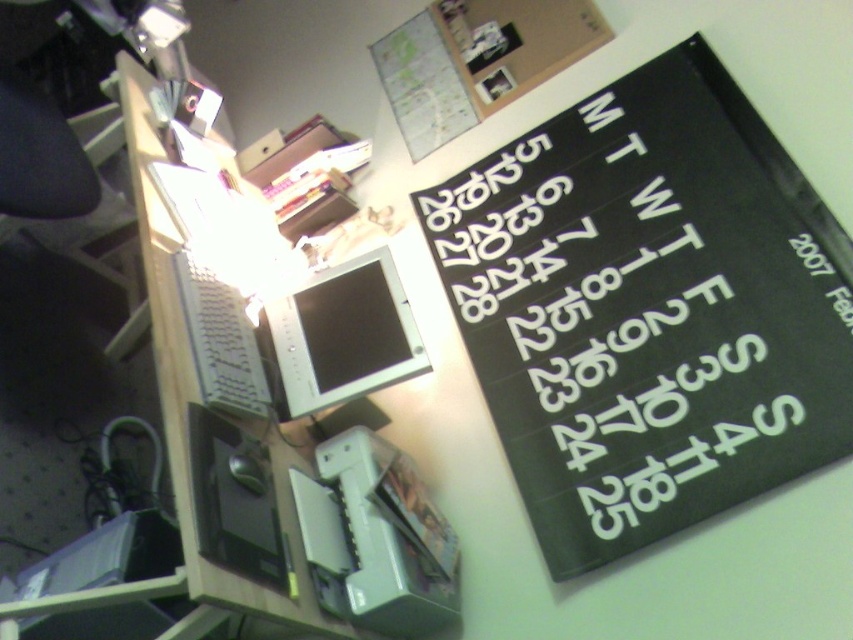
You are organizing your desk and want to place a new folder between the black paper calendar at upper right and the matte silver monitor at center. Can you do this without moving either of them?

The black paper calendar at upper right is in front of the matte silver monitor at center, so you can place the folder behind the calendar but in front of the monitor, or between them if there is space. However, since the calendar is already positioned in front, you might need to adjust their positions slightly to create space unless there is existing space between them.

You are organizing a presentation and need to check the schedule. You see the black paper calendar at upper right and the matte silver monitor at center. Which object is bigger in size?

The black paper calendar at upper right is larger in size than the matte silver monitor at center.